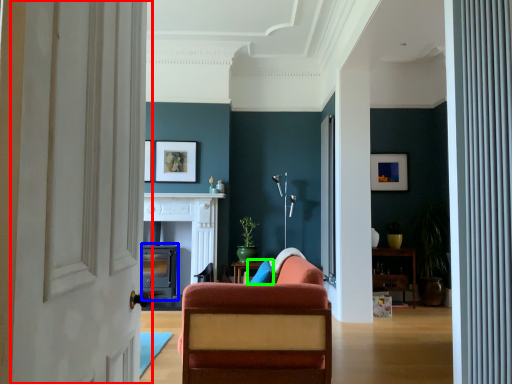
Question: Which object is the closest to the door (highlighted by a red box)? Choose among these: fireplace (highlighted by a blue box) or pillow (highlighted by a green box).

Choices:
 (A) fireplace
 (B) pillow

Answer: (B)